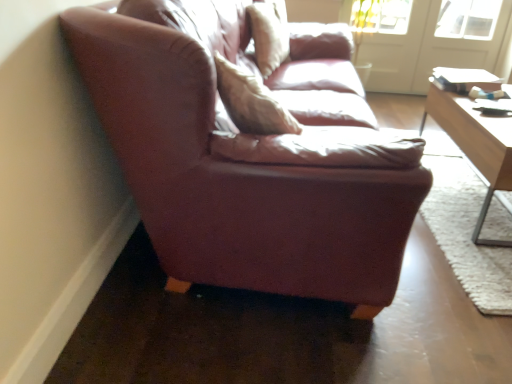
What is the approximate height of white glossy door at upper right, the first screen door positioned from the right?

white glossy door at upper right, the first screen door positioned from the right, is 32.00 inches tall.

The image size is (512, 384). Find the location of `white glass screen door at upper right, arranged as the first screen door when viewed from the left`. white glass screen door at upper right, arranged as the first screen door when viewed from the left is located at coordinates (392, 56).

You are a GUI agent. You are given a task and a screenshot of the screen. Output one action in this format:
    pyautogui.click(x=<x>, y=<y>)
    Task: Click on the leather couch at left
    The width and height of the screenshot is (512, 384).
    Given the screenshot: What is the action you would take?
    pyautogui.click(x=234, y=180)

In order to click on leather pillow at center in this screenshot , I will do `click(269, 34)`.

In order to face leather pillow at center, should I rotate leftwards or rightwards?

A 2.229 degree turn to the right will do.

At what (x,y) coordinates should I click in order to perform the action: click on light brown wooden table at right. Please return your answer as a coordinate pair (x, y). Image resolution: width=512 pixels, height=384 pixels. Looking at the image, I should click on (475, 145).

Where is `white glossy door at upper right, the second screen door when ordered from left to right`? The height and width of the screenshot is (384, 512). white glossy door at upper right, the second screen door when ordered from left to right is located at coordinates (429, 49).

Is there a large distance between leather pillow at center and leather couch at left?

That's right, there is a large distance between leather pillow at center and leather couch at left.

Between leather pillow at center and leather couch at left, which one has less height?

leather couch at left is shorter.

Is leather pillow at center oriented towards leather couch at left?

No, leather pillow at center is not aimed at leather couch at left.

How many degrees apart are the facing directions of leather pillow at center and leather couch at left?

There is a 166-degree angle between the facing directions of leather pillow at center and leather couch at left.

In the scene shown: Considering the relative sizes of white glossy door at upper right, the second screen door when ordered from left to right, and leather couch at left in the image provided, is white glossy door at upper right, the second screen door when ordered from left to right, thinner than leather couch at left?

Yes, white glossy door at upper right, the second screen door when ordered from left to right, is thinner than leather couch at left.

Would you say white glossy door at upper right, the first screen door positioned from the right, contains leather couch at left?

No, leather couch at left is not a part of white glossy door at upper right, the first screen door positioned from the right.

Are white glossy door at upper right, the second screen door when ordered from left to right, and leather couch at left beside each other?

white glossy door at upper right, the second screen door when ordered from left to right, and leather couch at left are clearly separated.

Is white glossy door at upper right, the second screen door when ordered from left to right, looking in the opposite direction of leather couch at left?

white glossy door at upper right, the second screen door when ordered from left to right, does not have its back to leather couch at left.

Locate an element on the screen. screen door that is the 1st object above the light brown wooden table at right (from a real-world perspective) is located at coordinates (392, 56).

Consider the image. Is white glass screen door at upper right, arranged as the first screen door when viewed from the left, far away from light brown wooden table at right?

Indeed, white glass screen door at upper right, arranged as the first screen door when viewed from the left, is not near light brown wooden table at right.

Can you confirm if white glass screen door at upper right, arranged as the first screen door when viewed from the left, is smaller than light brown wooden table at right?

Yes.

Measure the distance between white glass screen door at upper right, which is counted as the second screen door, starting from the right, and light brown wooden table at right.

white glass screen door at upper right, which is counted as the second screen door, starting from the right, is 1.74 meters from light brown wooden table at right.

From a real-world perspective, is leather pillow at center above or below light brown wooden table at right?

In terms of real-world spatial position, leather pillow at center is above light brown wooden table at right.

Does leather pillow at center have a larger size compared to light brown wooden table at right?

No, leather pillow at center is not bigger than light brown wooden table at right.

Does leather pillow at center appear on the left side of light brown wooden table at right?

Correct, you'll find leather pillow at center to the left of light brown wooden table at right.

Who is shorter, leather pillow at center or light brown wooden table at right?

leather pillow at center is shorter.

Which point is more distant from viewer, (361, 198) or (444, 43)?

The point (444, 43) is farther.

Considering the sizes of objects leather couch at left and white glossy door at upper right, the first screen door positioned from the right, in the image provided, who is wider, leather couch at left or white glossy door at upper right, the first screen door positioned from the right,?

With larger width is leather couch at left.

From a real-world perspective, is leather couch at left physically below white glossy door at upper right, the first screen door positioned from the right?

Indeed, from a real-world perspective, leather couch at left is positioned beneath white glossy door at upper right, the first screen door positioned from the right.

How different are the orientations of leather couch at left and white glossy door at upper right, the second screen door when ordered from left to right, in degrees?

91.1 degrees.

In the image, is white glossy door at upper right, the second screen door when ordered from left to right, on the left side or the right side of light brown wooden table at right?

white glossy door at upper right, the second screen door when ordered from left to right, is positioned on light brown wooden table at right's right side.

In terms of width, does white glossy door at upper right, the first screen door positioned from the right, look wider or thinner when compared to light brown wooden table at right?

In the image, white glossy door at upper right, the first screen door positioned from the right, appears to be more narrow than light brown wooden table at right.

In the image, is white glossy door at upper right, the first screen door positioned from the right, positioned in front of or behind light brown wooden table at right?

white glossy door at upper right, the first screen door positioned from the right, is behind light brown wooden table at right.

Is white glossy door at upper right, the second screen door when ordered from left to right, positioned with its back to light brown wooden table at right?

No, light brown wooden table at right is not at the back of white glossy door at upper right, the second screen door when ordered from left to right.

From the image's perspective, is light brown wooden table at right above or below leather couch at left?

From the image's perspective, light brown wooden table at right appears above leather couch at left.

Does point (502, 151) come farther from viewer compared to point (227, 198)?

Yes, it is behind point (227, 198).

From a real-world perspective, is light brown wooden table at right positioned over leather couch at left based on gravity?

Yes, from a real-world perspective, light brown wooden table at right is on top of leather couch at left.

Is light brown wooden table at right not near leather couch at left?

Yes, light brown wooden table at right and leather couch at left are located far from each other.

Where is `pillow that appears on the left of leather couch at left`? The height and width of the screenshot is (384, 512). pillow that appears on the left of leather couch at left is located at coordinates (269, 34).

Locate an element on the screen. The width and height of the screenshot is (512, 384). screen door that is the 2nd object to the right of the leather couch at left, starting at the anchor is located at coordinates (429, 49).

From the image, which object appears to be nearer to white glossy door at upper right, the first screen door positioned from the right, white glass screen door at upper right, which is counted as the second screen door, starting from the right, or light brown wooden table at right?

The object closer to white glossy door at upper right, the first screen door positioned from the right, is white glass screen door at upper right, which is counted as the second screen door, starting from the right.

Based on their spatial positions, is leather couch at left or leather pillow at center closer to white glossy door at upper right, the first screen door positioned from the right?

Answer: leather pillow at center is positioned closer to the anchor white glossy door at upper right, the first screen door positioned from the right.

Which object lies nearer to the anchor point light brown wooden table at right, leather couch at left or white glossy door at upper right, the second screen door when ordered from left to right?

Among the two, leather couch at left is located nearer to light brown wooden table at right.

Estimate the real-world distances between objects in this image. Which object is closer to light brown wooden table at right, white glass screen door at upper right, which is counted as the second screen door, starting from the right, or leather couch at left?

leather couch at left is positioned closer to the anchor light brown wooden table at right.

Considering their positions, is light brown wooden table at right positioned closer to leather pillow at center than leather couch at left?

light brown wooden table at right is positioned closer to the anchor leather pillow at center.

When comparing their distances from white glossy door at upper right, the first screen door positioned from the right, does leather pillow at center or light brown wooden table at right seem closer?

Among the two, leather pillow at center is located nearer to white glossy door at upper right, the first screen door positioned from the right.

Looking at the image, which one is located further to white glass screen door at upper right, arranged as the first screen door when viewed from the left, light brown wooden table at right or leather pillow at center?

light brown wooden table at right is positioned further to the anchor white glass screen door at upper right, arranged as the first screen door when viewed from the left.

Considering their positions, is light brown wooden table at right positioned further to white glass screen door at upper right, arranged as the first screen door when viewed from the left, than leather couch at left?

leather couch at left.

The height and width of the screenshot is (384, 512). I want to click on screen door between leather pillow at center and white glass screen door at upper right, arranged as the first screen door when viewed from the left, along the z-axis, so click(x=429, y=49).

The image size is (512, 384). In order to click on pillow between light brown wooden table at right and white glossy door at upper right, the first screen door positioned from the right, in the front-back direction in this screenshot , I will do `click(269, 34)`.

At what (x,y) coordinates should I click in order to perform the action: click on pillow between leather couch at left and white glossy door at upper right, the second screen door when ordered from left to right, along the z-axis. Please return your answer as a coordinate pair (x, y). Looking at the image, I should click on (269, 34).

What are the coordinates of `table between leather couch at left and white glass screen door at upper right, which is counted as the second screen door, starting from the right, in the front-back direction` in the screenshot? It's located at (475, 145).